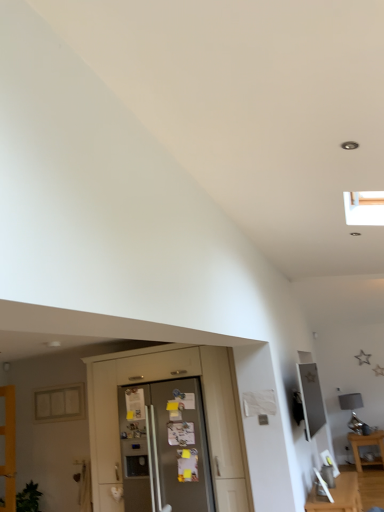
Question: Is metallic silver frame at upper right not within wooden door at left?

Choices:
 (A) no
 (B) yes

Answer: (B)

Question: From the image's perspective, is metallic silver frame at upper right located beneath wooden door at left?

Choices:
 (A) no
 (B) yes

Answer: (A)

Question: Would you say metallic silver frame at upper right is a long distance from wooden door at left?

Choices:
 (A) yes
 (B) no

Answer: (A)

Question: Is metallic silver frame at upper right thinner than wooden door at left?

Choices:
 (A) no
 (B) yes

Answer: (B)

Question: From a real-world perspective, is metallic silver frame at upper right located higher than wooden door at left?

Choices:
 (A) yes
 (B) no

Answer: (A)

Question: Does metallic silver frame at upper right have a larger size compared to wooden door at left?

Choices:
 (A) yes
 (B) no

Answer: (B)

Question: Considering the relative sizes of satin silver refrigerator at center and matte glass window at left in the image provided, is satin silver refrigerator at center thinner than matte glass window at left?

Choices:
 (A) yes
 (B) no

Answer: (B)

Question: Is matte glass window at left at the back of satin silver refrigerator at center?

Choices:
 (A) yes
 (B) no

Answer: (B)

Question: Considering the relative sizes of satin silver refrigerator at center and matte glass window at left in the image provided, is satin silver refrigerator at center smaller than matte glass window at left?

Choices:
 (A) yes
 (B) no

Answer: (B)

Question: Can you confirm if satin silver refrigerator at center is wider than matte glass window at left?

Choices:
 (A) yes
 (B) no

Answer: (A)

Question: From the image's perspective, is satin silver refrigerator at center under matte glass window at left?

Choices:
 (A) no
 (B) yes

Answer: (B)

Question: Are satin silver refrigerator at center and matte glass window at left beside each other?

Choices:
 (A) no
 (B) yes

Answer: (A)

Question: From the image's perspective, is wooden table at lower right on matte glass window at left?

Choices:
 (A) no
 (B) yes

Answer: (A)